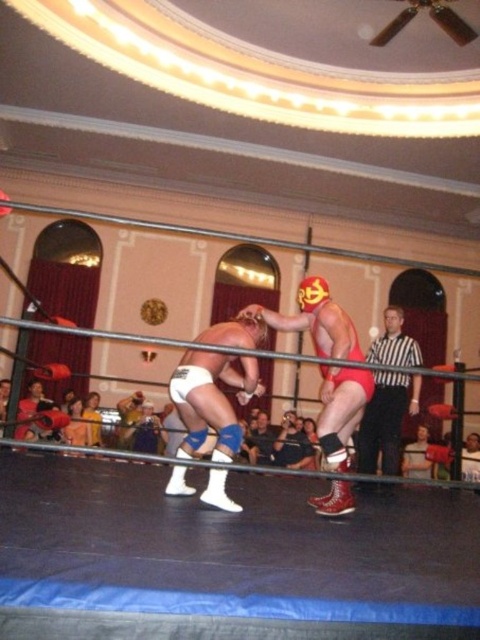
You are a referee in the wrestling match and need to ensure that the white matte shorts at center and the red matte wrestling mask at center are positioned correctly for the next move. Which object should you adjust to avoid blocking the opponent?

The white matte shorts at center is thinner than the red matte wrestling mask at center, so adjusting the white matte shorts at center would be better to avoid blocking the opponent.